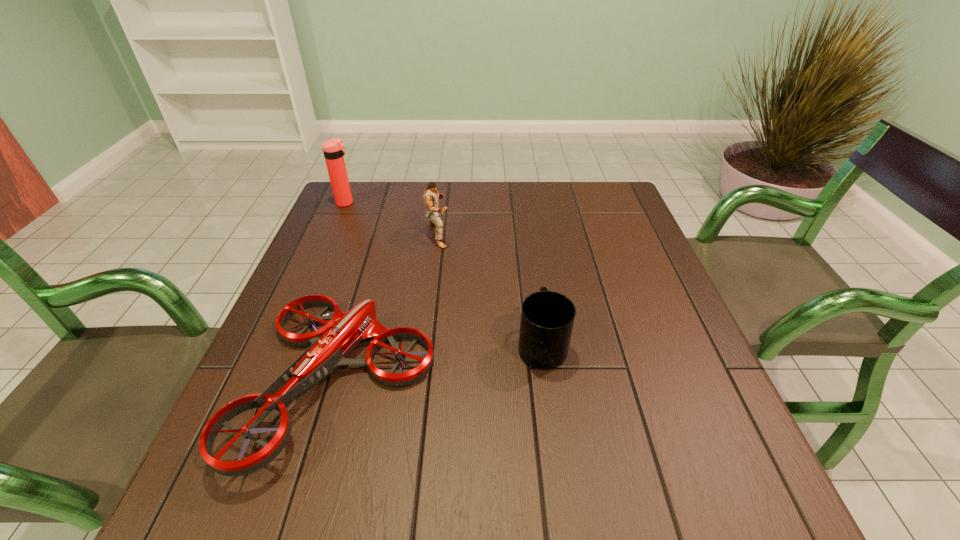
Locate an element on the screen. The height and width of the screenshot is (540, 960). vacant point located between the third tallest object and the shortest object is located at coordinates (442, 362).

At what (x,y) coordinates should I click in order to perform the action: click on vacant point located between the drone and the mug. Please return your answer as a coordinate pair (x, y). The height and width of the screenshot is (540, 960). Looking at the image, I should click on (442, 362).

Where is `vacant point located between the shortest object and the second shortest object`? vacant point located between the shortest object and the second shortest object is located at coordinates (442, 362).

Locate an element on the screen. The width and height of the screenshot is (960, 540). free space between the drone and the rightmost object is located at coordinates (442, 362).

Image resolution: width=960 pixels, height=540 pixels. In order to click on object identified as the third closest to the second farthest object in this screenshot , I will do `click(547, 317)`.

Locate an element on the screen. The image size is (960, 540). object that stands as the second closest to the farthest object is located at coordinates (330, 345).

Where is `blank area in the image that satisfies the following two spatial constraints: 1. on the side of the mug with the handle; 2. on the front-facing side of the second farthest object`? The image size is (960, 540). blank area in the image that satisfies the following two spatial constraints: 1. on the side of the mug with the handle; 2. on the front-facing side of the second farthest object is located at coordinates (527, 235).

Locate an element on the screen. This screenshot has height=540, width=960. vacant position in the image that satisfies the following two spatial constraints: 1. on the front-facing side of the third nearest object; 2. on the side of the mug with the handle is located at coordinates (424, 345).

Image resolution: width=960 pixels, height=540 pixels. What are the coordinates of `blank area in the image that satisfies the following two spatial constraints: 1. on the side of the third tallest object with the handle; 2. on the front-facing side of the third shortest object` in the screenshot? It's located at (527, 235).

Identify the location of vacant space that satisfies the following two spatial constraints: 1. on the front-facing side of the third shortest object; 2. on the side of the mug with the handle. (424, 345).